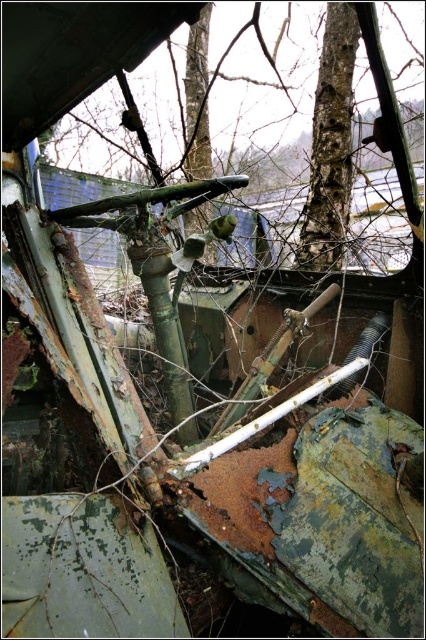
Question: Does green camouflage tree at center appear over rough bark tree at upper center?

Choices:
 (A) no
 (B) yes

Answer: (B)

Question: Which point is farther to the camera?

Choices:
 (A) (296, 115)
 (B) (328, 33)

Answer: (A)

Question: Observing the image, what is the correct spatial positioning of green camouflage tree at center in reference to rough bark tree at upper center?

Choices:
 (A) left
 (B) right

Answer: (A)

Question: Can you confirm if green camouflage tree at center is positioned to the right of rough bark tree at upper center?

Choices:
 (A) no
 (B) yes

Answer: (A)